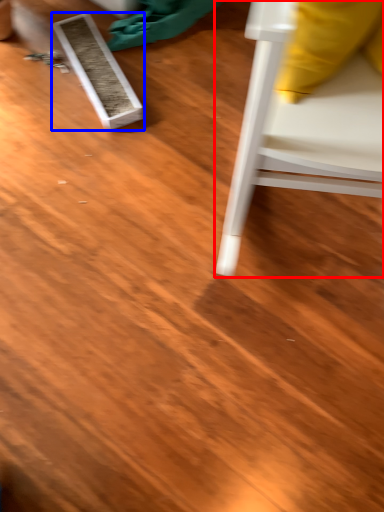
Question: Which object appears farthest to the camera in this image, furniture (highlighted by a red box) or plank (highlighted by a blue box)?

Choices:
 (A) furniture
 (B) plank

Answer: (B)